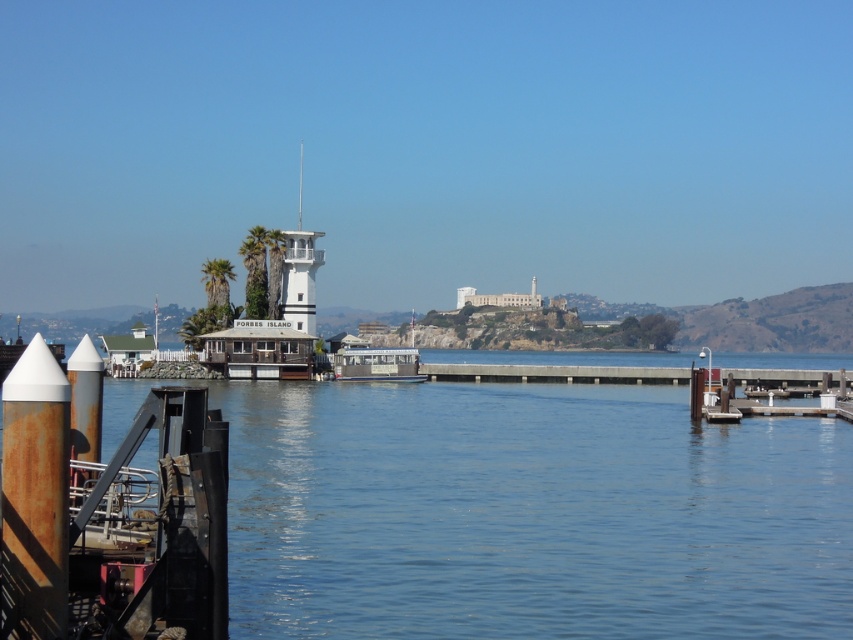
Measure the distance between green leafy palm tree at center and white wooden dock at center.

green leafy palm tree at center and white wooden dock at center are 13.77 meters apart from each other.

Is green leafy palm tree at center below white wooden dock at center?

Incorrect, green leafy palm tree at center is not positioned below white wooden dock at center.

In order to click on green leafy palm tree at center in this screenshot , I will do `click(262, 272)`.

Between white painted wood tower at center and green leafy palm tree at center, which one is positioned lower?

Positioned lower is green leafy palm tree at center.

Which is more to the right, white painted wood tower at center or green leafy palm tree at center?

Positioned to the right is green leafy palm tree at center.

Is point (305, 300) closer to viewer compared to point (256, 236)?

Yes, it is in front of point (256, 236).

Where is `white painted wood tower at center`? Image resolution: width=853 pixels, height=640 pixels. white painted wood tower at center is located at coordinates (299, 269).

You are a GUI agent. You are given a task and a screenshot of the screen. Output one action in this format:
    pyautogui.click(x=<x>, y=<y>)
    Task: Click on the white painted wood tower at center
    
    Given the screenshot: What is the action you would take?
    pyautogui.click(x=299, y=269)

The image size is (853, 640). In order to click on white painted wood tower at center in this screenshot , I will do `click(299, 269)`.

The image size is (853, 640). I want to click on white painted wood tower at center, so click(x=299, y=269).